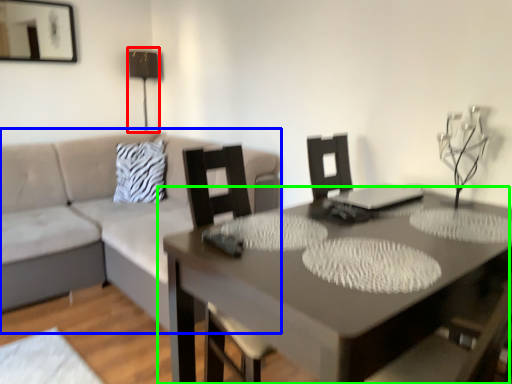
Question: Which is nearer to the table lamp (highlighted by a red box)? studio couch (highlighted by a blue box) or table (highlighted by a green box).

Choices:
 (A) studio couch
 (B) table

Answer: (A)